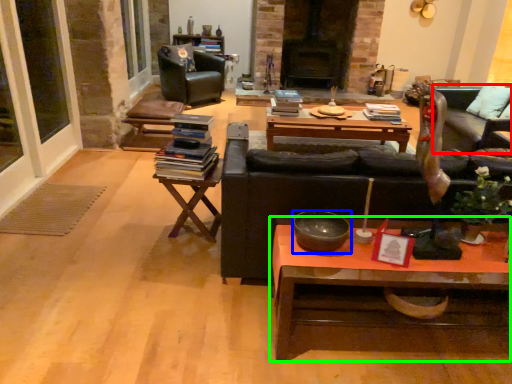
Question: Based on their relative distances, which object is nearer to couch (highlighted by a red box)? Choose from bowl (highlighted by a blue box) and coffee table (highlighted by a green box).

Choices:
 (A) bowl
 (B) coffee table

Answer: (B)